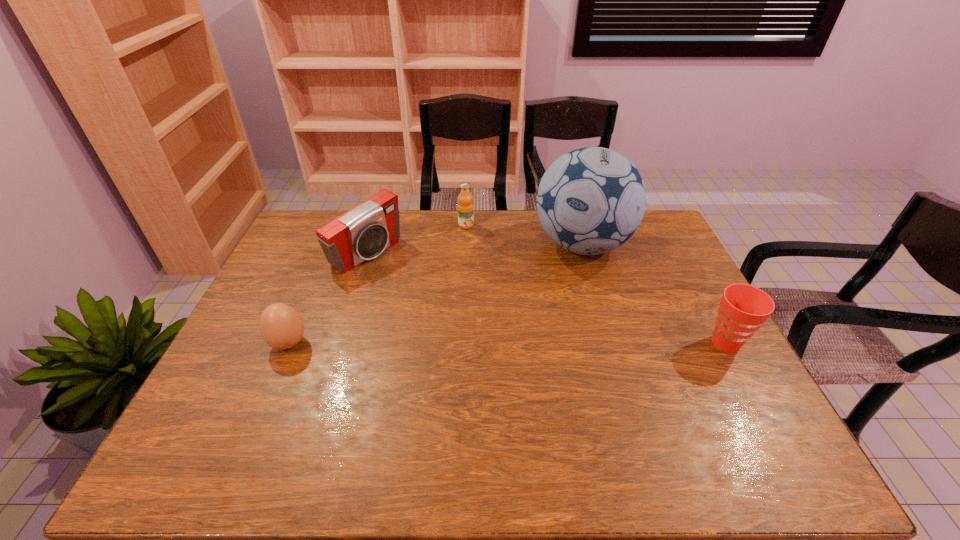
Where is `vacant space located 0.340m on the front-facing side of the camera`? vacant space located 0.340m on the front-facing side of the camera is located at coordinates (463, 321).

Where is `blank area located 0.160m on the side with brand of the tallest object`? The image size is (960, 540). blank area located 0.160m on the side with brand of the tallest object is located at coordinates (571, 310).

This screenshot has height=540, width=960. I want to click on free spot located on the side with brand of the tallest object, so click(x=563, y=360).

Where is `vacant region located 0.240m on the side with brand of the tallest object`? vacant region located 0.240m on the side with brand of the tallest object is located at coordinates coord(567,330).

At what (x,y) coordinates should I click in order to perform the action: click on vacant region located on the label of the third object from left to right. Please return your answer as a coordinate pair (x, y). Image resolution: width=960 pixels, height=540 pixels. Looking at the image, I should click on (505, 275).

Where is `vacant region located on the label of the third object from left to right`? This screenshot has height=540, width=960. vacant region located on the label of the third object from left to right is located at coordinates (486, 251).

The image size is (960, 540). Identify the location of vacant region located on the label of the third object from left to right. (491, 257).

The image size is (960, 540). What are the coordinates of `camera at the far edge` in the screenshot? It's located at (365, 231).

Where is `soccer ball that is at the far edge`? Image resolution: width=960 pixels, height=540 pixels. soccer ball that is at the far edge is located at coordinates (590, 201).

Locate an element on the screen. The height and width of the screenshot is (540, 960). orange juice that is at the far edge is located at coordinates (465, 206).